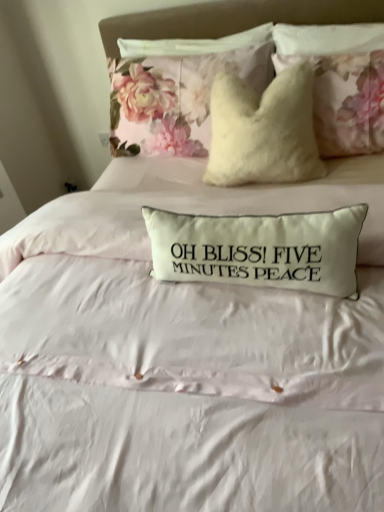
Question: Can you confirm if white fabric pillow at center, acting as the 1th pillow starting from the bottom, is positioned to the right of fluffy white pillow at upper center?

Choices:
 (A) yes
 (B) no

Answer: (B)

Question: Considering the relative sizes of white fabric pillow at center, placed as the 2th pillow when sorted from top to bottom, and fluffy white pillow at upper center in the image provided, is white fabric pillow at center, placed as the 2th pillow when sorted from top to bottom, smaller than fluffy white pillow at upper center?

Choices:
 (A) yes
 (B) no

Answer: (A)

Question: Is white fabric pillow at center, acting as the 1th pillow starting from the bottom, aimed at fluffy white pillow at upper center?

Choices:
 (A) no
 (B) yes

Answer: (A)

Question: Is white fabric pillow at center, acting as the 1th pillow starting from the bottom, beside fluffy white pillow at upper center?

Choices:
 (A) no
 (B) yes

Answer: (A)

Question: Can you confirm if white fabric pillow at center, marked as the 2th pillow in a back-to-front arrangement, is wider than fluffy white pillow at upper center?

Choices:
 (A) no
 (B) yes

Answer: (A)

Question: Is point (266, 69) closer or farther from the camera than point (266, 1)?

Choices:
 (A) farther
 (B) closer

Answer: (A)

Question: Is floral fabric cushion at upper center, which is the 1th pillow in top-to-bottom order, spatially inside fluffy white pillow at upper center, or outside of it?

Choices:
 (A) outside
 (B) inside

Answer: (A)

Question: Relative to fluffy white pillow at upper center, is floral fabric cushion at upper center, the 2th pillow from the front, in front or behind?

Choices:
 (A) behind
 (B) front

Answer: (A)

Question: In terms of size, does floral fabric cushion at upper center, positioned as the first pillow in back-to-front order, appear bigger or smaller than fluffy white pillow at upper center?

Choices:
 (A) small
 (B) big

Answer: (B)

Question: Relative to floral fabric cushion at upper center, positioned as the first pillow in back-to-front order, is white fabric pillow at center, the 1th pillow viewed from the front, in front or behind?

Choices:
 (A) front
 (B) behind

Answer: (A)

Question: Would you say white fabric pillow at center, the 1th pillow viewed from the front, is to the left or to the right of floral fabric cushion at upper center, the 2th pillow from the front, in the picture?

Choices:
 (A) right
 (B) left

Answer: (A)

Question: Is white fabric pillow at center, the 1th pillow viewed from the front, situated inside floral fabric cushion at upper center, the 2th pillow from the front, or outside?

Choices:
 (A) outside
 (B) inside

Answer: (A)

Question: In terms of height, does white fabric pillow at center, placed as the 2th pillow when sorted from top to bottom, look taller or shorter compared to floral fabric cushion at upper center, positioned as the first pillow in back-to-front order?

Choices:
 (A) short
 (B) tall

Answer: (A)

Question: Looking at their shapes, would you say floral fabric cushion at upper center, which is the 2th pillow from bottom to top, is wider or thinner than white fabric pillow at center, marked as the 2th pillow in a back-to-front arrangement?

Choices:
 (A) thin
 (B) wide

Answer: (B)

Question: From the image's perspective, is floral fabric cushion at upper center, which is the 1th pillow in top-to-bottom order, above or below white fabric pillow at center, marked as the 2th pillow in a back-to-front arrangement?

Choices:
 (A) below
 (B) above

Answer: (B)